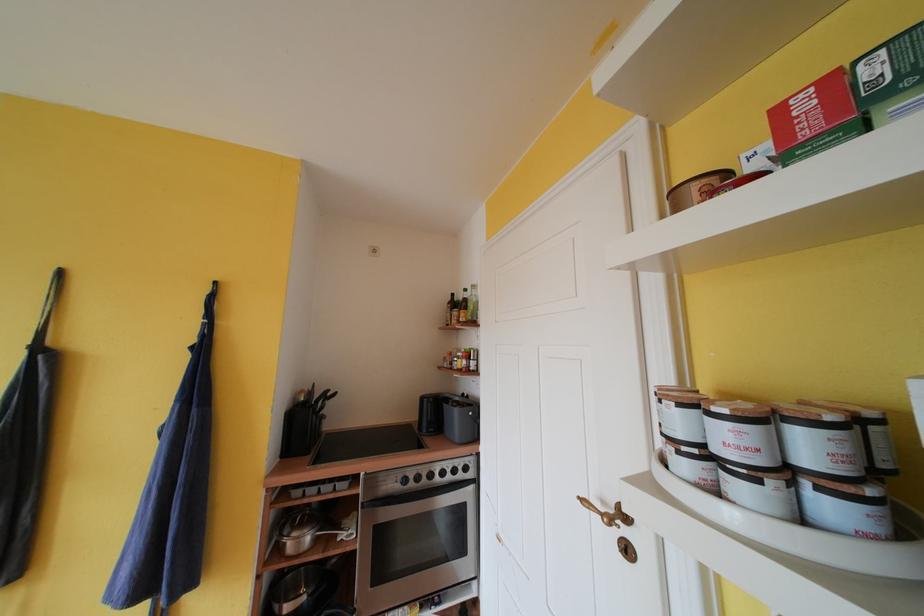
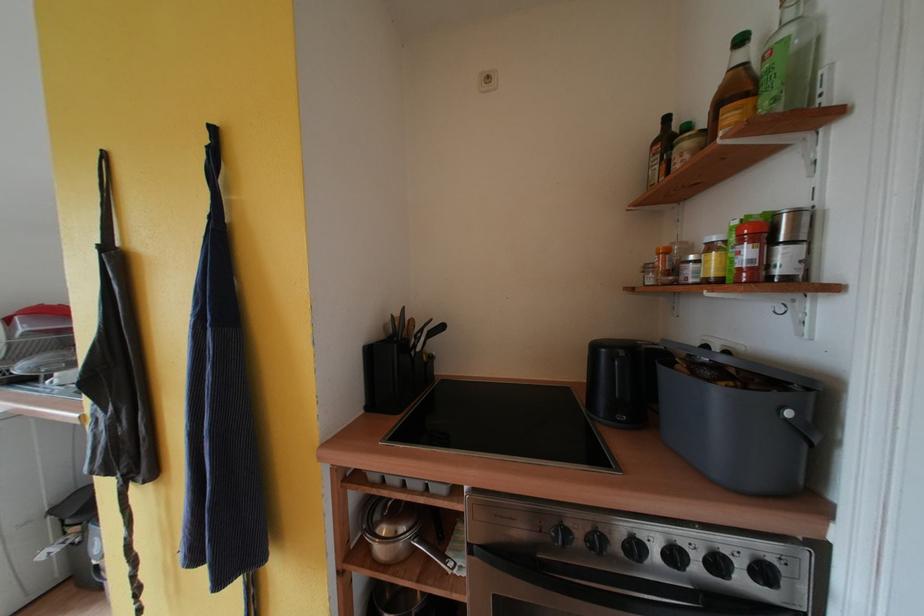
Locate, in the second image, the point that corresponds to (334,394) in the first image.

(436, 323)